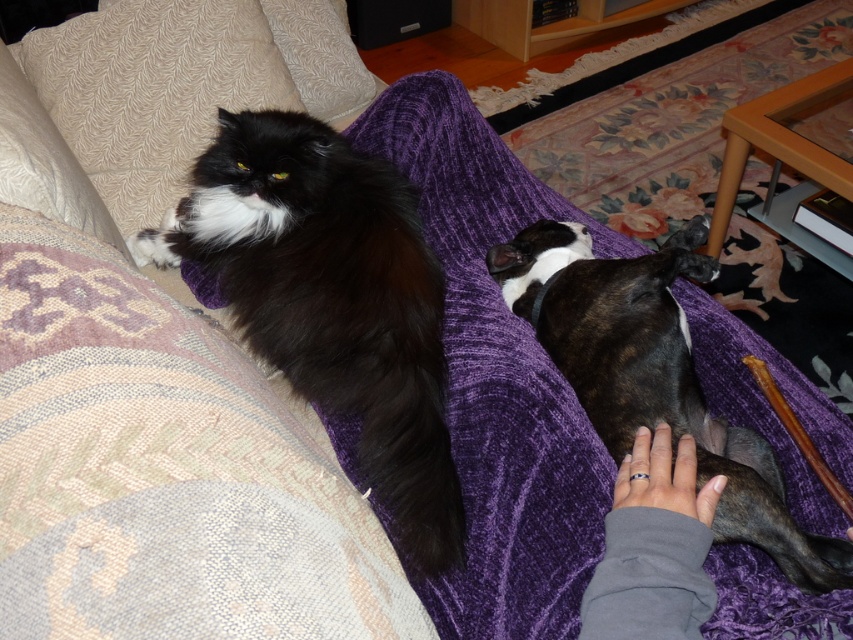
Question: Does brindle fur dog at lower right appear on the left side of gray fleece hand at lower center?

Choices:
 (A) no
 (B) yes

Answer: (A)

Question: Which object appears closest to the camera in this image?

Choices:
 (A) brindle fur dog at lower right
 (B) beige textured pillow at upper left

Answer: (A)

Question: Which point appears closest to the camera in this image?

Choices:
 (A) (622, 612)
 (B) (102, 212)

Answer: (A)

Question: Can you confirm if brindle fur dog at lower right is positioned to the left of beige textured pillow at upper left?

Choices:
 (A) yes
 (B) no

Answer: (B)

Question: Which point is farther to the camera?

Choices:
 (A) beige textured pillow at upper left
 (B) black fluffy cat at upper left

Answer: (A)

Question: Is brindle fur dog at lower right positioned before beige textured pillow at upper left?

Choices:
 (A) yes
 (B) no

Answer: (A)